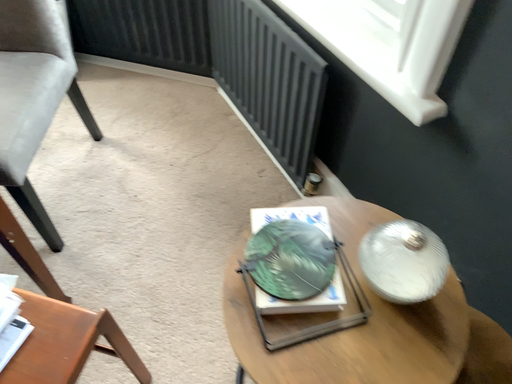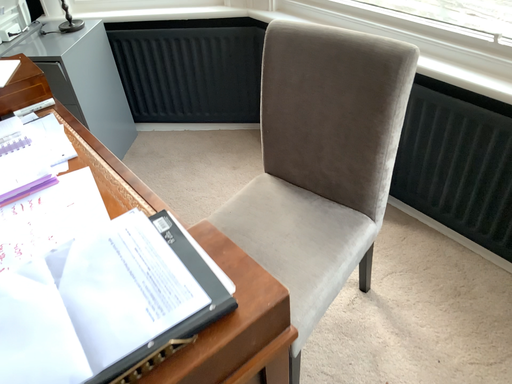
Question: Which way did the camera rotate in the video?

Choices:
 (A) rotated left
 (B) rotated right

Answer: (A)